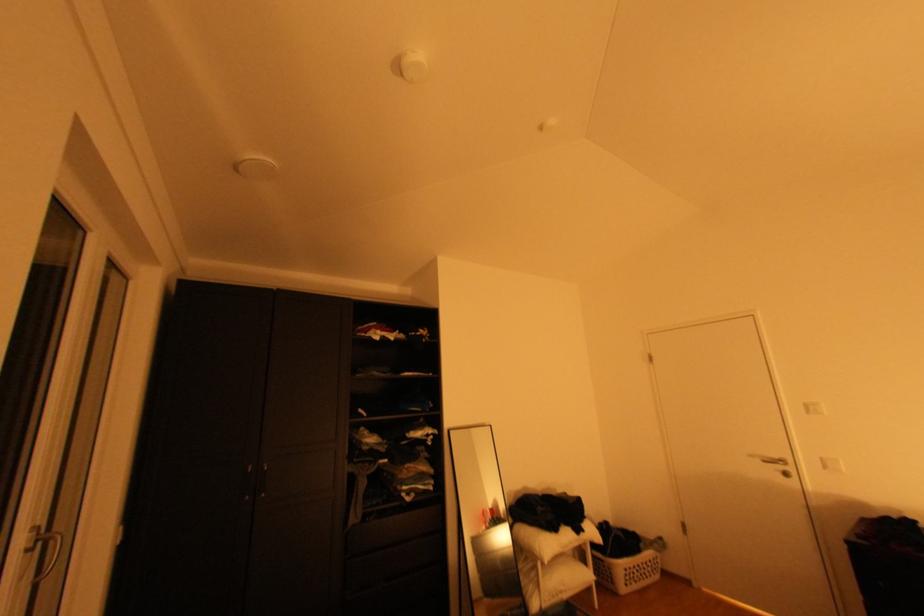
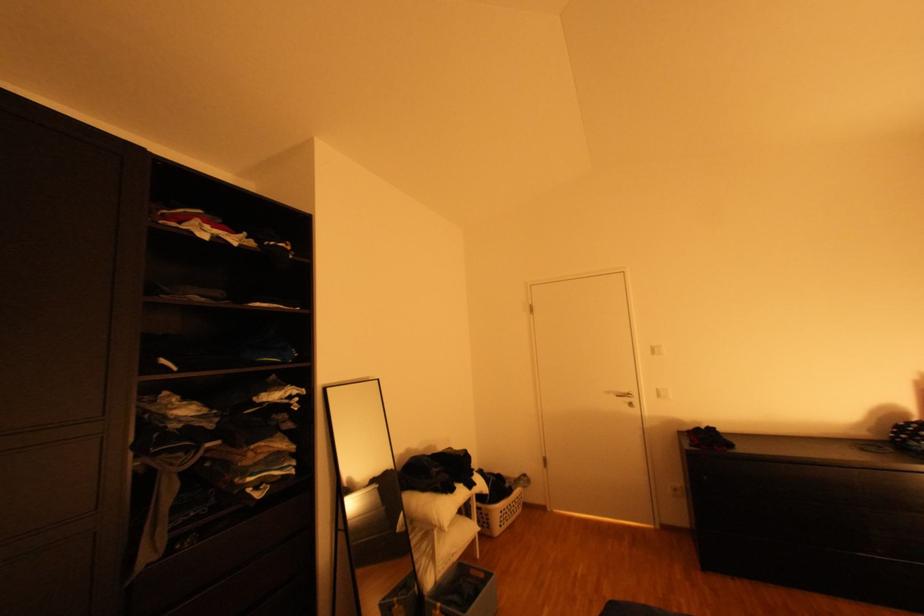
The point at (762, 456) is marked in the first image. Where is the corresponding point in the second image?

(617, 392)